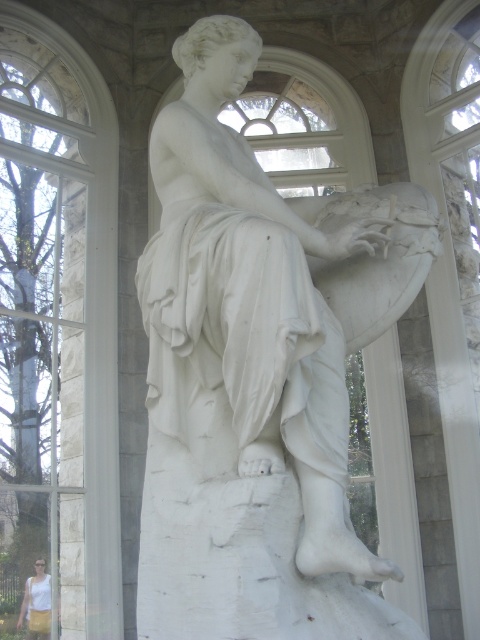
Does point (330, 460) lie in front of point (74, 232)?

Yes, point (330, 460) is closer to viewer.

Is white marble statue at center taller than clear glass window at upper left?

No.

Does point (322, 420) lie behind point (73, 628)?

No.

The image size is (480, 640). Identify the location of white marble statue at center. (259, 372).

Is clear glass window at upper left further to the viewer compared to white cotton tank top at lower left?

Yes, it is behind white cotton tank top at lower left.

Which is in front, point (58, 480) or point (48, 611)?

Point (48, 611) is in front.

Locate an element on the screen. clear glass window at upper left is located at coordinates (58, 324).

Does white marble statue at center have a smaller size compared to white cotton tank top at lower left?

Actually, white marble statue at center might be larger than white cotton tank top at lower left.

The image size is (480, 640). What do you see at coordinates (259, 372) in the screenshot? I see `white marble statue at center` at bounding box center [259, 372].

The height and width of the screenshot is (640, 480). I want to click on white marble statue at center, so (259, 372).